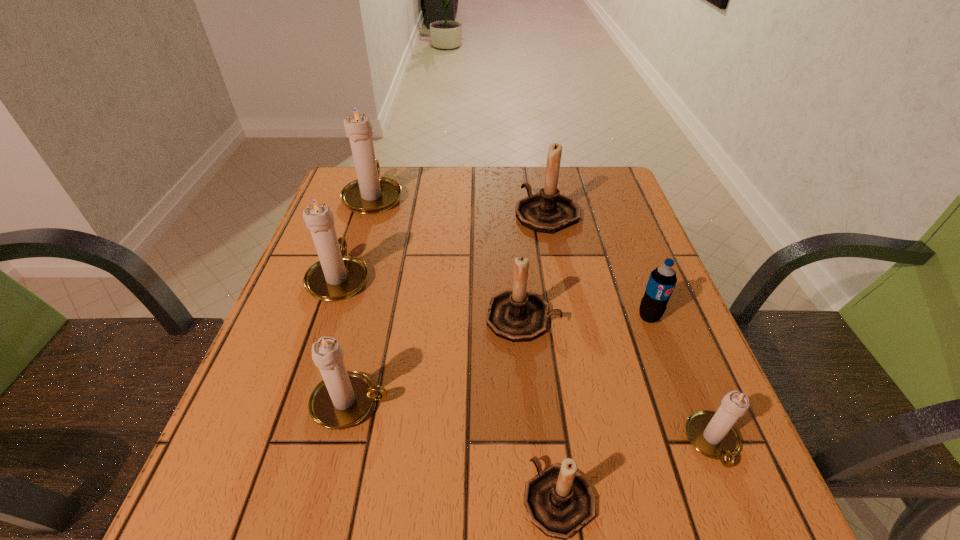
Identify which brown candle holder is the second closest to the second farthest brown candle holder. Please provide its 2D coordinates. Your answer should be formatted as a tuple, i.e. [(x, y)], where the tuple contains the x and y coordinates of a point satisfying the conditions above.

[(559, 501)]

Image resolution: width=960 pixels, height=540 pixels. I want to click on brown candle holder that is the closest one to the third nearest white candle holder, so [x=517, y=315].

The width and height of the screenshot is (960, 540). I want to click on free space that satisfies the following two spatial constraints: 1. on the front side of the second smallest brown candle holder; 2. on the handle side of the third biggest white candle holder, so click(x=531, y=403).

Find the location of a particular element. free space in the image that satisfies the following two spatial constraints: 1. on the handle side of the second farthest white candle holder; 2. on the left side of the farthest brown candle holder is located at coordinates (361, 214).